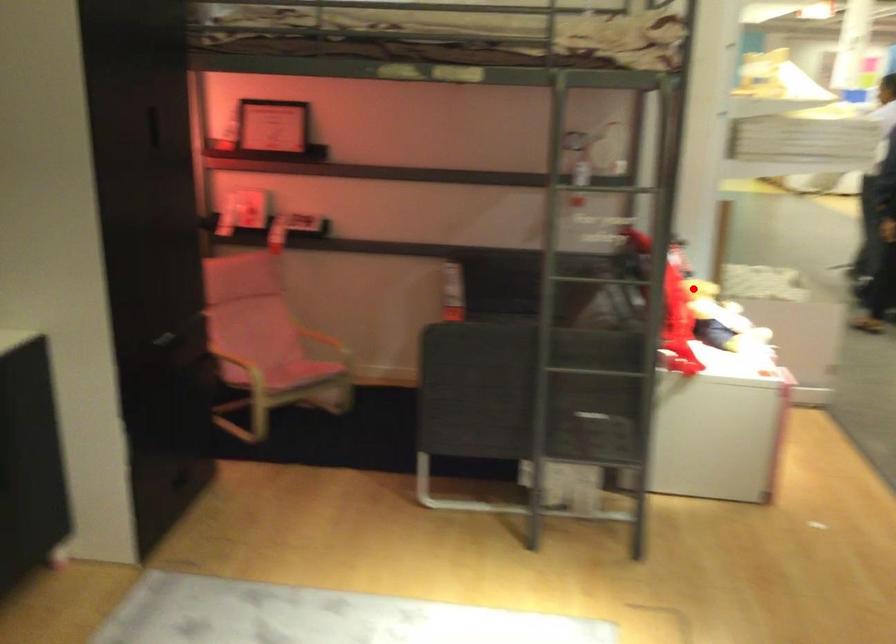
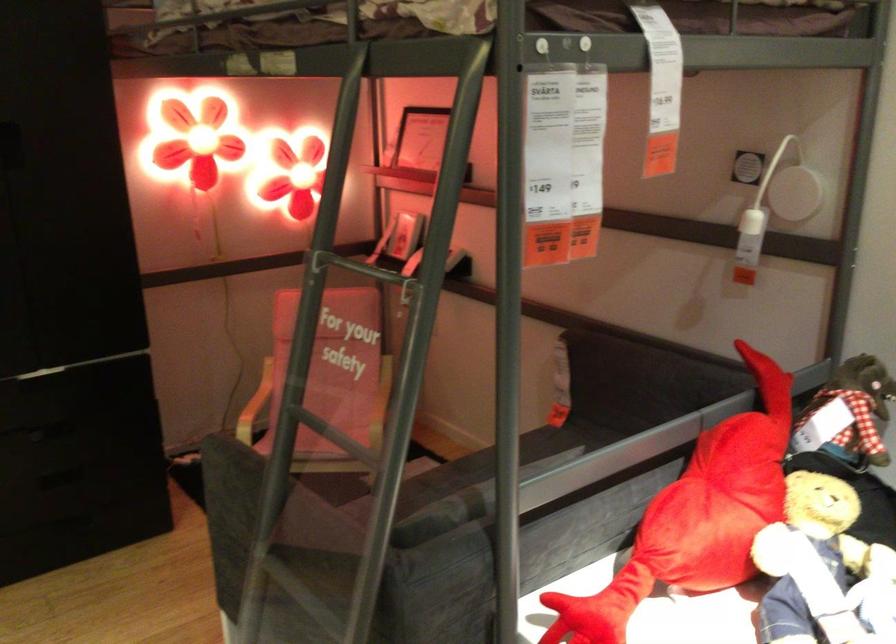
Question: I am providing you with two images of the same scene from different viewpoints. In image1, a red point is highlighted. Considering the same 3D point in image2, which of the following is correct?

Choices:
 (A) It is closer
 (B) It is farther

Answer: (A)